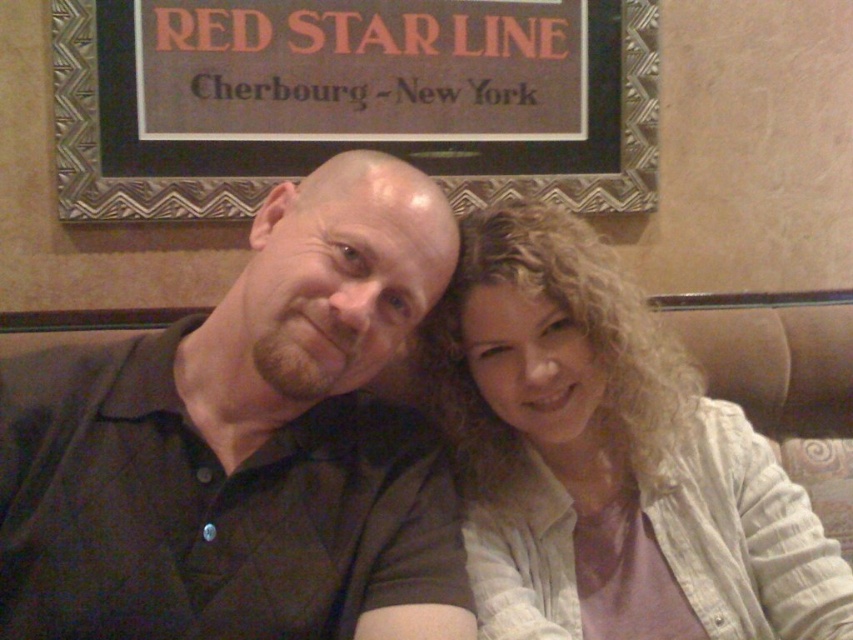
You are a tailor measuring shirts for alterations. You see the dark green shirt at left and the light beige fabric shirt at center. Which shirt requires a longer hem? Please explain your reasoning based on the provided information.

The light beige fabric shirt at center requires a longer hem because it is taller than the dark green shirt at left, so its hem needs to be adjusted accordingly.

You are a photographer trying to capture a group photo of the dark green shirt at left and the light beige fabric shirt at center. If you want to ensure both shirts are clearly visible in the photo, which shirt should you focus on first?

The dark green shirt at left is smaller than the light beige fabric shirt at center, so you should focus on the light beige fabric shirt at center first to ensure it is clearly visible.